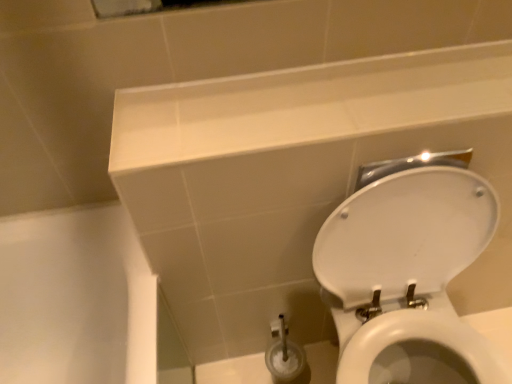
You are a GUI agent. You are given a task and a screenshot of the screen. Output one action in this format:
    pyautogui.click(x=<x>, y=<y>)
    Task: Click on the white glossy toilet at lower right
    The image size is (512, 384).
    Given the screenshot: What is the action you would take?
    coord(407,277)

Looking at this image, what is the approximate height of white glossy toilet at lower right?

The height of white glossy toilet at lower right is 30.18 inches.

What do you see at coordinates (407, 277) in the screenshot? I see `white glossy toilet at lower right` at bounding box center [407, 277].

The image size is (512, 384). What do you see at coordinates (307, 105) in the screenshot?
I see `white glossy ledge at upper center` at bounding box center [307, 105].

What are the coordinates of `white glossy ledge at upper center` in the screenshot? It's located at (307, 105).

This screenshot has width=512, height=384. Identify the location of white glossy toilet at lower right. (407, 277).

Is white glossy toilet at lower right at the right side of white glossy ledge at upper center?

Indeed, white glossy toilet at lower right is positioned on the right side of white glossy ledge at upper center.

In the image, is white glossy toilet at lower right positioned in front of or behind white glossy ledge at upper center?

Clearly, white glossy toilet at lower right is in front of white glossy ledge at upper center.

Which is farther from the camera, (465, 348) or (159, 109)?

The point (465, 348) is behind.

From the image's perspective, is white glossy toilet at lower right below white glossy ledge at upper center?

Yes, from the image's perspective, white glossy toilet at lower right is beneath white glossy ledge at upper center.

From a real-world perspective, is white glossy toilet at lower right under white glossy ledge at upper center?

Indeed, from a real-world perspective, white glossy toilet at lower right is positioned beneath white glossy ledge at upper center.

Does white glossy toilet at lower right have a greater width compared to white glossy ledge at upper center?

Correct, the width of white glossy toilet at lower right exceeds that of white glossy ledge at upper center.

Considering the sizes of white glossy toilet at lower right and white glossy ledge at upper center in the image, is white glossy toilet at lower right taller or shorter than white glossy ledge at upper center?

Considering their sizes, white glossy toilet at lower right has more height than white glossy ledge at upper center.

Who is bigger, white glossy toilet at lower right or white glossy ledge at upper center?

With larger size is white glossy toilet at lower right.

Would you say white glossy toilet at lower right is outside white glossy ledge at upper center?

Yes, white glossy toilet at lower right is not within white glossy ledge at upper center.

Is white glossy toilet at lower right far from white glossy ledge at upper center?

No, white glossy toilet at lower right is in close proximity to white glossy ledge at upper center.

Is white glossy toilet at lower right facing away from white glossy ledge at upper center?

That's not correct — white glossy toilet at lower right is not looking away from white glossy ledge at upper center.

How different are the orientations of white glossy toilet at lower right and white glossy ledge at upper center in degrees?

The angle between the facing direction of white glossy toilet at lower right and the facing direction of white glossy ledge at upper center is 0.349 degrees.

How far apart are white glossy toilet at lower right and white glossy ledge at upper center?

white glossy toilet at lower right is 13.44 inches from white glossy ledge at upper center.

At what (x,y) coordinates should I click in order to perform the action: click on ledge on the left of white glossy toilet at lower right. Please return your answer as a coordinate pair (x, y). This screenshot has height=384, width=512. Looking at the image, I should click on pos(307,105).

Which object is positioned more to the left, white glossy ledge at upper center or white glossy toilet at lower right?

Positioned to the left is white glossy ledge at upper center.

Is the depth of white glossy ledge at upper center greater than that of white glossy toilet at lower right?

Yes, white glossy ledge at upper center is further from the viewer.

Does point (149, 118) lie in front of point (416, 303)?

That is True.

From the image's perspective, is white glossy ledge at upper center positioned above or below white glossy toilet at lower right?

From the image's perspective, white glossy ledge at upper center appears above white glossy toilet at lower right.

From a real-world perspective, is white glossy ledge at upper center on white glossy toilet at lower right?

Yes, from a real-world perspective, white glossy ledge at upper center is over white glossy toilet at lower right

Which object is thinner, white glossy ledge at upper center or white glossy toilet at lower right?

white glossy ledge at upper center.

Between white glossy ledge at upper center and white glossy toilet at lower right, which one has more height?

Standing taller between the two is white glossy toilet at lower right.

Who is bigger, white glossy ledge at upper center or white glossy toilet at lower right?

With larger size is white glossy toilet at lower right.

Is white glossy ledge at upper center completely or partially outside of white glossy toilet at lower right?

Yes, white glossy ledge at upper center is not within white glossy toilet at lower right.

Would you consider white glossy ledge at upper center to be distant from white glossy toilet at lower right?

white glossy ledge at upper center is actually quite close to white glossy toilet at lower right.

Is white glossy ledge at upper center positioned with its back to white glossy toilet at lower right?

No, white glossy toilet at lower right is not at the back of white glossy ledge at upper center.

Can you tell me how much white glossy ledge at upper center and white glossy toilet at lower right differ in facing direction?

white glossy ledge at upper center and white glossy toilet at lower right are facing 0.349 degrees away from each other.

This screenshot has width=512, height=384. What are the coordinates of `ledge above the white glossy toilet at lower right (from a real-world perspective)` in the screenshot? It's located at (307, 105).

This screenshot has height=384, width=512. What are the coordinates of `ledge above the white glossy toilet at lower right (from the image's perspective)` in the screenshot? It's located at (307, 105).

This screenshot has height=384, width=512. What are the coordinates of `ledge behind the white glossy toilet at lower right` in the screenshot? It's located at (307, 105).